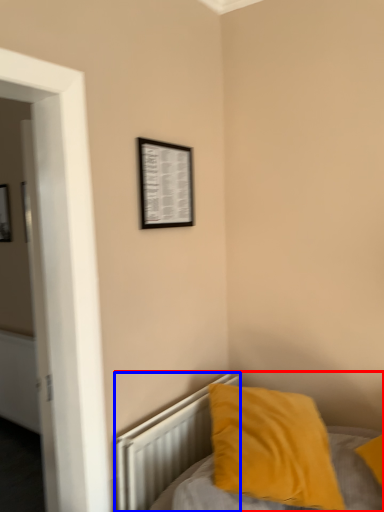
Question: Which point is further to the camera, bed (highlighted by a red box) or radiator (highlighted by a blue box)?

Choices:
 (A) bed
 (B) radiator

Answer: (B)